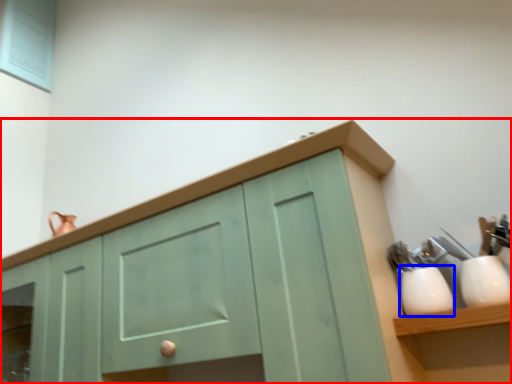
Question: Which point is further to the camera, cabinetry (highlighted by a red box) or tableware (highlighted by a blue box)?

Choices:
 (A) cabinetry
 (B) tableware

Answer: (B)